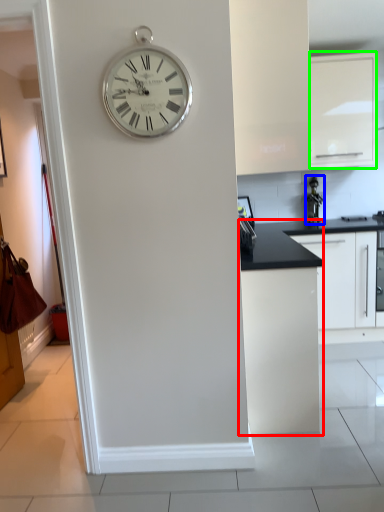
Question: Considering the real-world distances, which object is farthest from cabinetry (highlighted by a red box)? appliance (highlighted by a blue box) or cabinetry (highlighted by a green box)?

Choices:
 (A) appliance
 (B) cabinetry

Answer: (B)